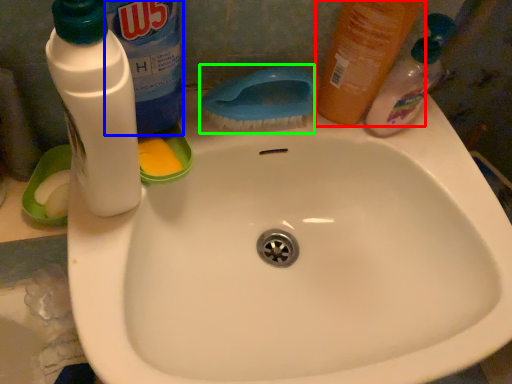
Question: Which object is positioned closest to cleaning product (highlighted by a red box)? Select from cleaning product (highlighted by a blue box) and brush (highlighted by a green box).

Choices:
 (A) cleaning product
 (B) brush

Answer: (B)